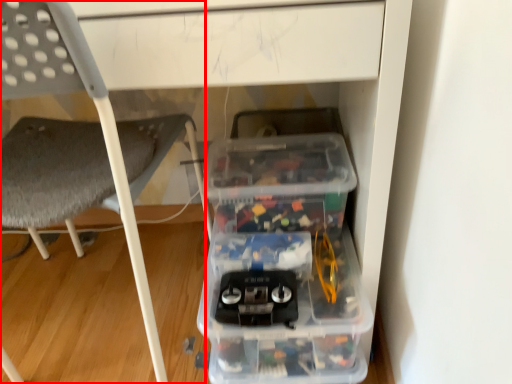
Question: Where is chair (annotated by the red box) located in relation to storage box in the image?

Choices:
 (A) left
 (B) right

Answer: (A)